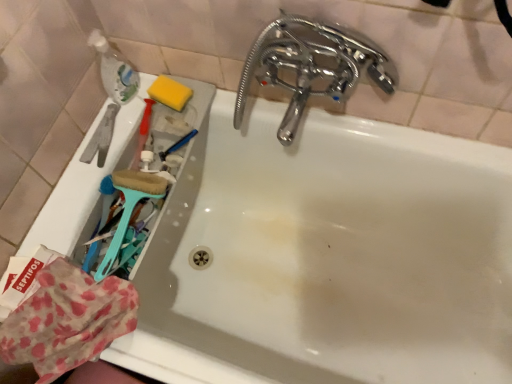
Identify the location of free spot to the left of yellow sponge at upper left. The width and height of the screenshot is (512, 384). (133, 118).